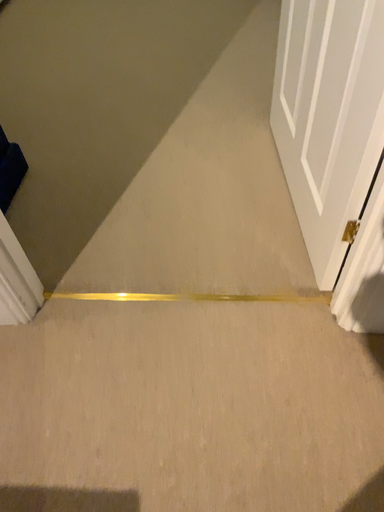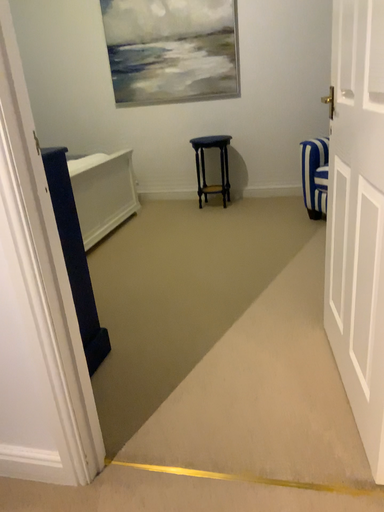
Question: How did the camera likely rotate when shooting the video?

Choices:
 (A) rotated left
 (B) rotated right

Answer: (A)